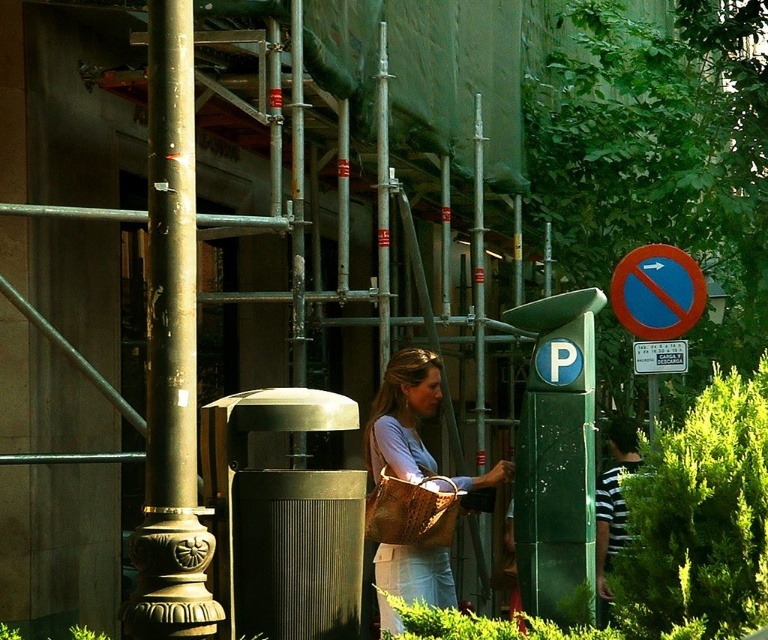
Can you confirm if gold polished metal pole at left is positioned to the left of red circular sign at upper right?

Yes, gold polished metal pole at left is to the left of red circular sign at upper right.

The width and height of the screenshot is (768, 640). I want to click on gold polished metal pole at left, so click(x=170, y=355).

You are a GUI agent. You are given a task and a screenshot of the screen. Output one action in this format:
    pyautogui.click(x=<x>, y=<y>)
    Task: Click on the gold polished metal pole at left
    The height and width of the screenshot is (640, 768).
    Given the screenshot: What is the action you would take?
    pyautogui.click(x=170, y=355)

Is matte brown woven bag at center wider than red circular sign at upper right?

Yes, matte brown woven bag at center is wider than red circular sign at upper right.

Which is more to the right, matte brown woven bag at center or red circular sign at upper right?

From the viewer's perspective, red circular sign at upper right appears more on the right side.

Identify the location of matte brown woven bag at center. (414, 426).

Where is `matte brown woven bag at center`? The width and height of the screenshot is (768, 640). matte brown woven bag at center is located at coordinates (414, 426).

Is green metallic parking meter at center-right wider than red circular sign at upper right?

In fact, green metallic parking meter at center-right might be narrower than red circular sign at upper right.

Does green metallic parking meter at center-right appear under red circular sign at upper right?

Correct, green metallic parking meter at center-right is located below red circular sign at upper right.

What do you see at coordinates (555, 458) in the screenshot? The height and width of the screenshot is (640, 768). I see `green metallic parking meter at center-right` at bounding box center [555, 458].

Where is `green metallic parking meter at center-right`? The image size is (768, 640). green metallic parking meter at center-right is located at coordinates [x=555, y=458].